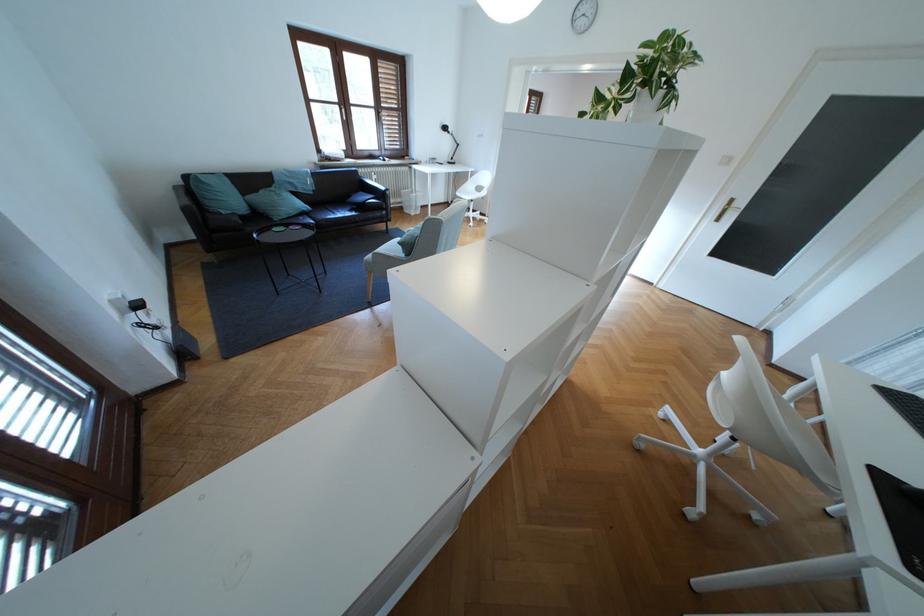
At what (x,y) coordinates should I click in order to perform the action: click on white plant pot. Please return your answer as a coordinate pair (x, y). Looking at the image, I should click on (647, 76).